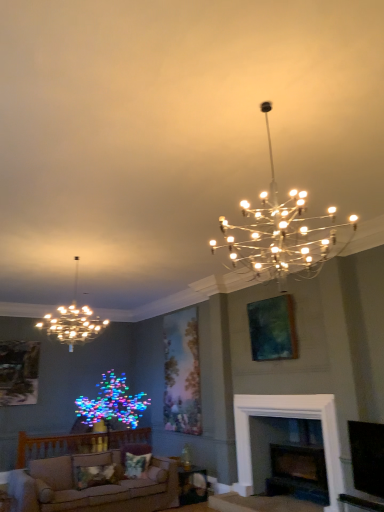
Question: From the image's perspective, is wooden textured picture frame at left, the second picture frame positioned from the right, positioned above or below beige fabric couch at lower left?

Choices:
 (A) above
 (B) below

Answer: (A)

Question: Considering their positions, is wooden textured picture frame at left, the 1th picture frame viewed from the back, located in front of or behind beige fabric couch at lower left?

Choices:
 (A) front
 (B) behind

Answer: (B)

Question: Estimate the real-world distances between objects in this image. Which object is farther from the dark wood fireplace at lower center?

Choices:
 (A) matte gold chandelier at upper left, the first lamp viewed from the left
 (B) fluffy fabric pillow at lower center
 (C) wooden textured picture frame at left, arranged as the second picture frame when viewed from the front
 (D) metallic chandelier at upper center, marked as the second lamp in a left-to-right arrangement
 (E) beige fabric couch at lower left

Answer: (C)

Question: Based on their relative distances, which object is nearer to the beige fabric couch at lower left?

Choices:
 (A) metallic chandelier at upper center, the first lamp in the right-to-left sequence
 (B) dark wood fireplace at lower center
 (C) matte gold chandelier at upper left, the 2th lamp in the front-to-back sequence
 (D) wooden textured picture frame at left, the 1th picture frame from the bottom
 (E) wooden table at lower center

Answer: (E)